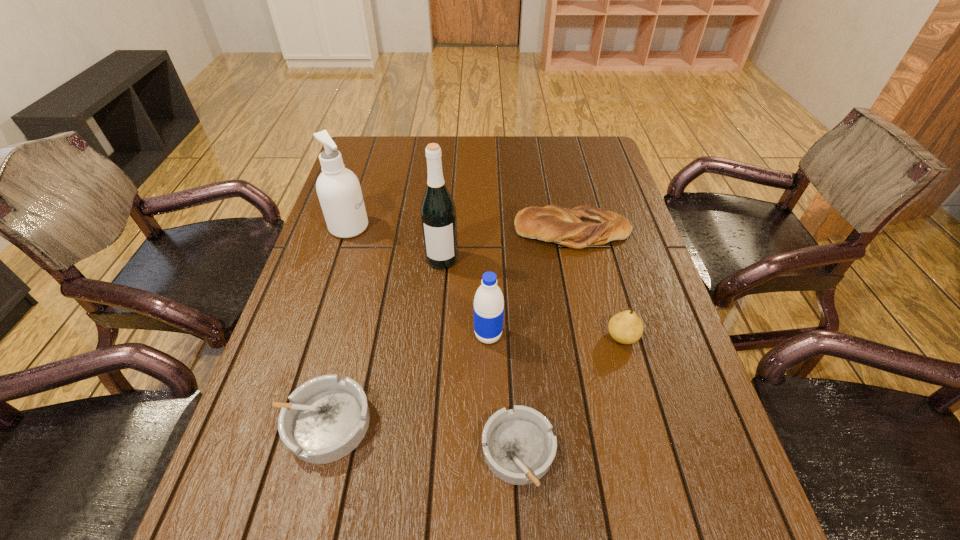
This screenshot has width=960, height=540. I want to click on object at the near left corner, so click(327, 417).

The width and height of the screenshot is (960, 540). In the image, there is a desktop. In order to click on vacant space at the far edge in this screenshot , I will do `click(487, 172)`.

In the image, there is a desktop. Where is `blank space at the near edge`? blank space at the near edge is located at coordinates (602, 447).

Identify the location of free region at the left edge of the desktop. (365, 196).

Identify the location of vacant space at the right edge of the desktop. (600, 267).

The width and height of the screenshot is (960, 540). What are the coordinates of `vacant area that lies between the water bottle and the fourth tallest object` in the screenshot? It's located at (555, 336).

Find the location of a particular element. The image size is (960, 540). blank region between the right ashtray and the cleansing agent is located at coordinates (434, 340).

Where is `vacant point located between the cleansing agent and the water bottle`? vacant point located between the cleansing agent and the water bottle is located at coordinates (419, 281).

Where is `vacant space in between the left ashtray and the third tallest object`? This screenshot has width=960, height=540. vacant space in between the left ashtray and the third tallest object is located at coordinates (406, 379).

Image resolution: width=960 pixels, height=540 pixels. What are the coordinates of `vacant space in between the left ashtray and the third object from left to right` in the screenshot? It's located at (383, 341).